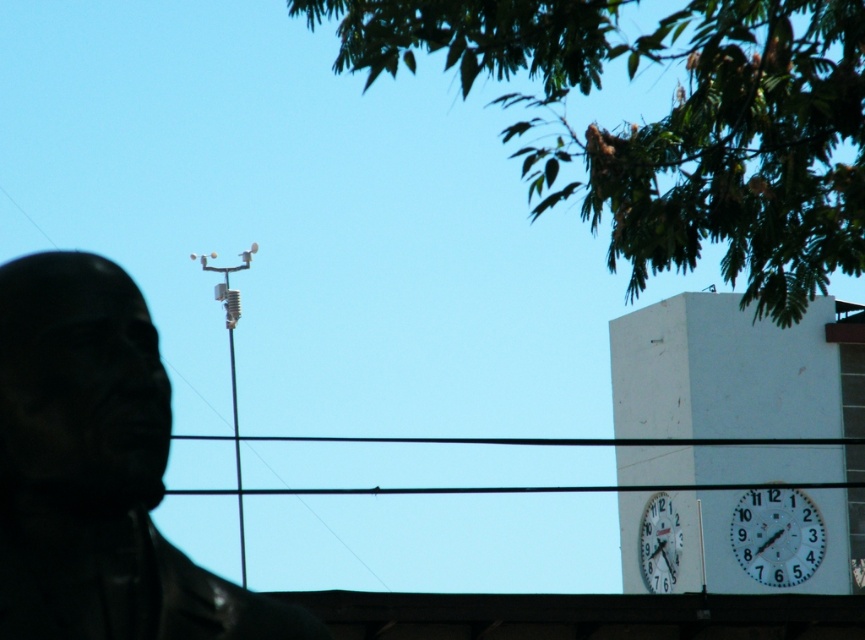
Question: Among these points, which one is farthest from the camera?

Choices:
 (A) (760, 288)
 (B) (862, 508)
 (C) (56, 477)
 (D) (809, 518)

Answer: (B)

Question: Considering the real-world distances, which object is farthest from the white glossy clock at upper right?

Choices:
 (A) white glossy clock at right
 (B) white painted concrete clock tower at right

Answer: (A)

Question: Is black matte statue at upper left behind white glossy clock at right?

Choices:
 (A) yes
 (B) no

Answer: (B)

Question: Can you confirm if white painted concrete clock tower at right is positioned to the right of white glossy clock at upper right?

Choices:
 (A) yes
 (B) no

Answer: (A)

Question: Observing the image, what is the correct spatial positioning of green leafy tree at upper center in reference to white glossy clock at upper right?

Choices:
 (A) right
 (B) left

Answer: (B)

Question: Which of these objects is positioned farthest from the white glossy clock at right?

Choices:
 (A) white glossy clock at upper right
 (B) black matte statue at upper left
 (C) green leafy tree at upper center

Answer: (B)